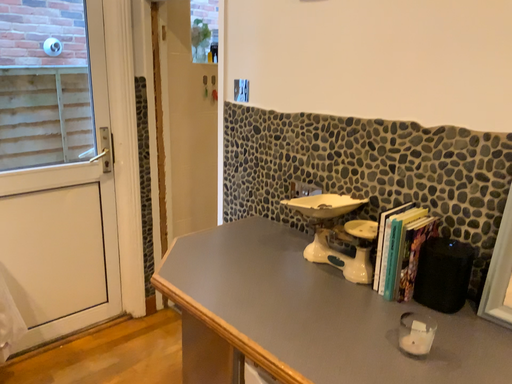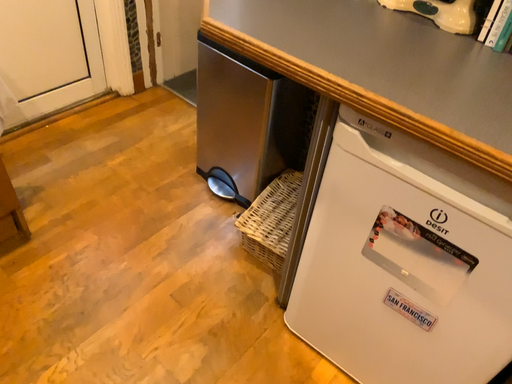
Question: How did the camera likely rotate when shooting the video?

Choices:
 (A) rotated downward
 (B) rotated upward

Answer: (A)